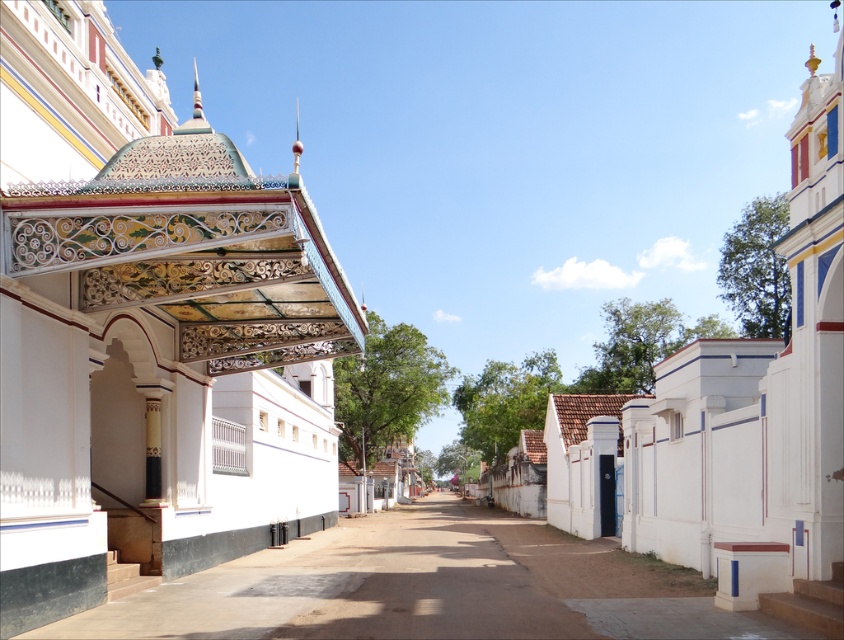
Consider the image. Does decorative painted ceiling at upper left come behind white painted wall at center?

Yes, it is.

The height and width of the screenshot is (640, 844). I want to click on decorative painted ceiling at upper left, so click(x=160, y=369).

You are a GUI agent. You are given a task and a screenshot of the screen. Output one action in this format:
    pyautogui.click(x=<x>, y=<y>)
    Task: Click on the decorative painted ceiling at upper left
    This screenshot has height=640, width=844.
    Given the screenshot: What is the action you would take?
    [x=160, y=369]

Between decorative painted ceiling at upper left and smooth concrete alley at center, which one is positioned lower?

Positioned lower is smooth concrete alley at center.

Measure the distance between decorative painted ceiling at upper left and camera.

decorative painted ceiling at upper left and camera are 30.40 feet apart.

Is point (231, 291) positioned after point (315, 566)?

No, it is not.

Find the location of `decorative painted ceiling at upper left`. decorative painted ceiling at upper left is located at coordinates (160, 369).

Based on the photo, which of these two, white painted wall at center or smooth concrete alley at center, stands taller?

white painted wall at center

Between point (575, 413) and point (237, 564), which one is positioned behind?

Positioned behind is point (575, 413).

At what (x,y) coordinates should I click in order to perform the action: click on white painted wall at center. Please return your answer as a coordinate pair (x, y). Looking at the image, I should click on (734, 422).